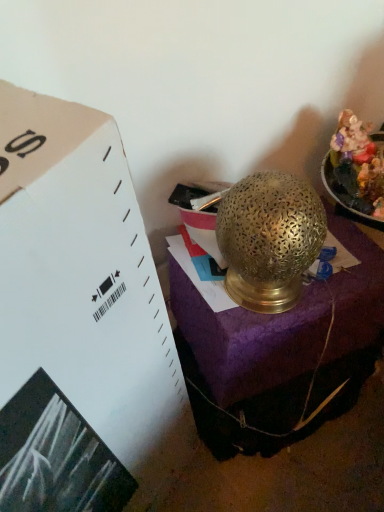
The image size is (384, 512). What do you see at coordinates (356, 167) in the screenshot?
I see `shiny metallic food at upper right` at bounding box center [356, 167].

What is the approximate width of gold textured lamp at center?

gold textured lamp at center is 5.48 inches wide.

What do you see at coordinates (280, 352) in the screenshot? This screenshot has height=512, width=384. I see `gold textured lamp at center` at bounding box center [280, 352].

This screenshot has height=512, width=384. Identify the location of shiny metallic food at upper right. (356, 167).

Is shiny metallic food at upper right oriented towards gold textured lamp at center?

No, shiny metallic food at upper right is not oriented towards gold textured lamp at center.

From the image's perspective, is shiny metallic food at upper right located beneath gold textured lamp at center?

No, from the image's perspective, shiny metallic food at upper right is not below gold textured lamp at center.

Between shiny metallic food at upper right and gold textured lamp at center, which one has larger size?

Bigger between the two is gold textured lamp at center.

Is shiny metallic food at upper right next to gold textured lamp at center?

They are not placed beside each other.

Is point (278, 408) behind point (179, 201)?

Yes, it is behind point (179, 201).

From a real-world perspective, is gold textured lamp at center below gold textured lamp at center?

Yes.

Considering the sizes of gold textured lamp at center and gold textured lamp at center in the image, is gold textured lamp at center wider or thinner than gold textured lamp at center?

Considering their sizes, gold textured lamp at center looks broader than gold textured lamp at center.

Which of these two, gold textured lamp at center or gold textured lamp at center, stands taller?

Standing taller between the two is gold textured lamp at center.

The width and height of the screenshot is (384, 512). Identify the location of box above the gold textured lamp at center (from the image's perspective). (200, 216).

Is gold textured lamp at center oriented away from gold textured lamp at center?

No, gold textured lamp at center is not facing the opposite direction of gold textured lamp at center.

Who is bigger, gold textured lamp at center or gold textured lamp at center?

gold textured lamp at center is bigger.

Is gold textured lamp at center aimed at shiny metallic food at upper right?

No, gold textured lamp at center is not turned towards shiny metallic food at upper right.

Is point (264, 344) closer or farther from the camera than point (351, 201)?

Point (264, 344) appears to be farther away from the viewer than point (351, 201).

What's the angular difference between gold textured lamp at center and shiny metallic food at upper right's facing directions?

They differ by 42.4 degrees in their facing directions.

Does gold textured lamp at center have a greater height compared to shiny metallic food at upper right?

Indeed, gold textured lamp at center has a greater height compared to shiny metallic food at upper right.

Is gold textured lamp at center not within shiny metallic food at upper right?

gold textured lamp at center lies outside shiny metallic food at upper right's area.

Between gold textured lamp at center and shiny metallic food at upper right, which one has smaller size?

Smaller between the two is shiny metallic food at upper right.

Does shiny metallic food at upper right have a greater height compared to gold textured lamp at center?

Incorrect, the height of shiny metallic food at upper right is not larger of that of gold textured lamp at center.

Find the location of a particular element. The width and height of the screenshot is (384, 512). food lying on the right of gold textured lamp at center is located at coordinates (356, 167).

From the image's perspective, is shiny metallic food at upper right beneath gold textured lamp at center?

Answer: Incorrect, from the image's perspective, shiny metallic food at upper right is higher than gold textured lamp at center.

Is shiny metallic food at upper right oriented towards gold textured lamp at center?

No.

In order to click on food above the gold textured lamp at center (from a real-world perspective) in this screenshot , I will do `click(356, 167)`.

In the image, there is a gold textured lamp at center. Where is `box above it (from the image's perspective)`? The height and width of the screenshot is (512, 384). box above it (from the image's perspective) is located at coordinates (200, 216).

Looking at this image, when comparing their distances from shiny metallic food at upper right, does gold textured lamp at center or gold textured lamp at center seem further?

Among the two, gold textured lamp at center is located further to shiny metallic food at upper right.

Consider the image. Based on their spatial positions, is shiny metallic food at upper right or gold textured lamp at center further from gold textured lamp at center?

gold textured lamp at center is positioned further to the anchor gold textured lamp at center.

Based on their spatial positions, is shiny metallic food at upper right or gold textured lamp at center further from gold textured lamp at center?

Among the two, shiny metallic food at upper right is located further to gold textured lamp at center.

Looking at the image, which one is located closer to gold textured lamp at center, gold textured lamp at center or shiny metallic food at upper right?

shiny metallic food at upper right.

Which object lies nearer to the anchor point shiny metallic food at upper right, gold textured lamp at center or gold textured lamp at center?

gold textured lamp at center is positioned closer to the anchor shiny metallic food at upper right.

Looking at the image, which one is located closer to gold textured lamp at center, gold textured lamp at center or shiny metallic food at upper right?

Among the two, gold textured lamp at center is located nearer to gold textured lamp at center.

Where is `furniture situated between gold textured lamp at center and shiny metallic food at upper right from left to right`? This screenshot has width=384, height=512. furniture situated between gold textured lamp at center and shiny metallic food at upper right from left to right is located at coordinates (280, 352).